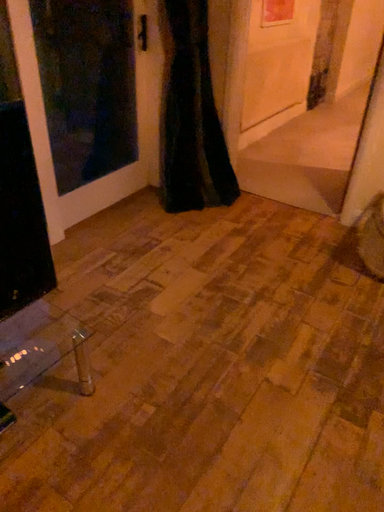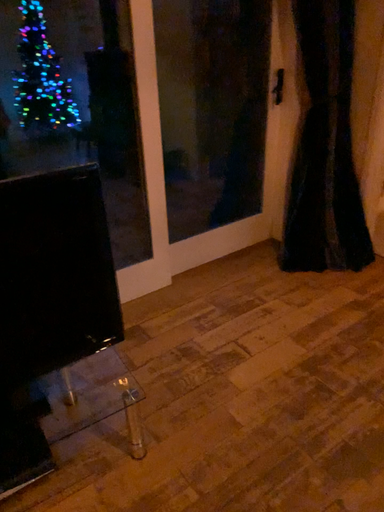
Question: How did the camera likely rotate when shooting the video?

Choices:
 (A) rotated left
 (B) rotated right

Answer: (A)